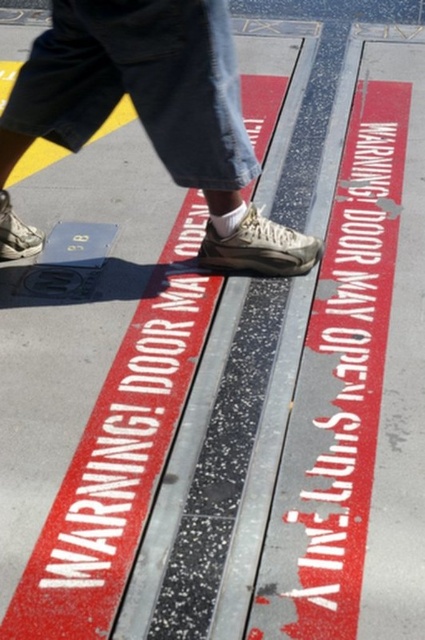
Can you confirm if matte gray sneakers at center is positioned above white painted text at center?

Yes.

Who is more distant from viewer, (152, 140) or (334, 246)?

Point (334, 246)

The width and height of the screenshot is (425, 640). Identify the location of matte gray sneakers at center. (150, 116).